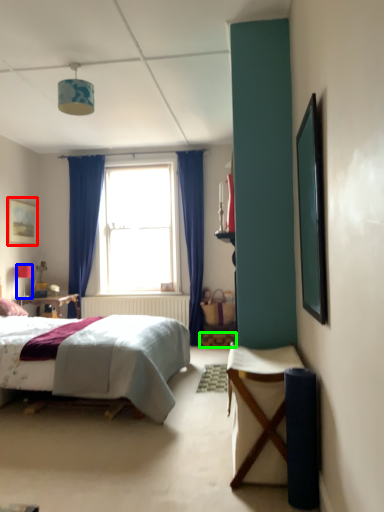
Question: Which object is positioned farthest from picture frame (highlighted by a red box)? Select from lamp (highlighted by a blue box) and stool (highlighted by a green box).

Choices:
 (A) lamp
 (B) stool

Answer: (B)